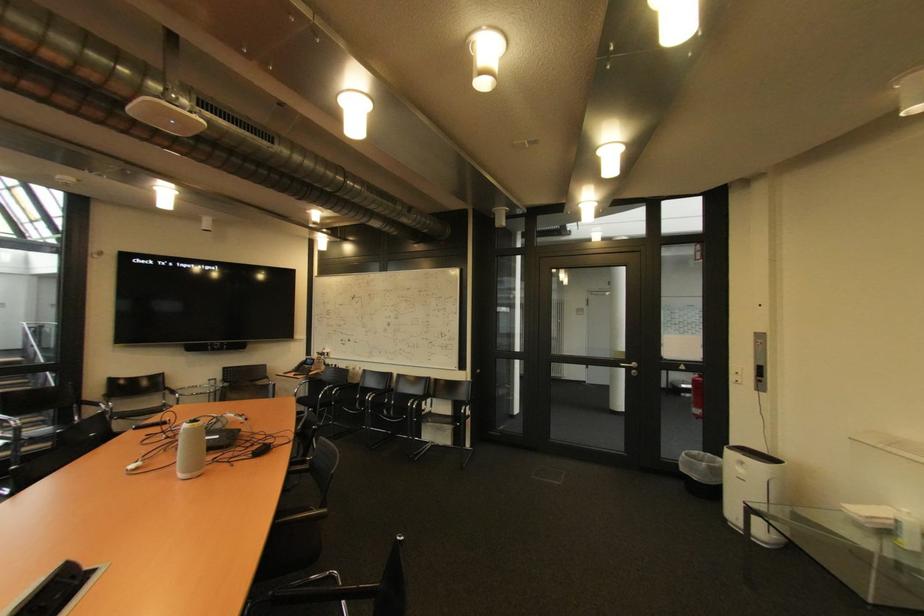
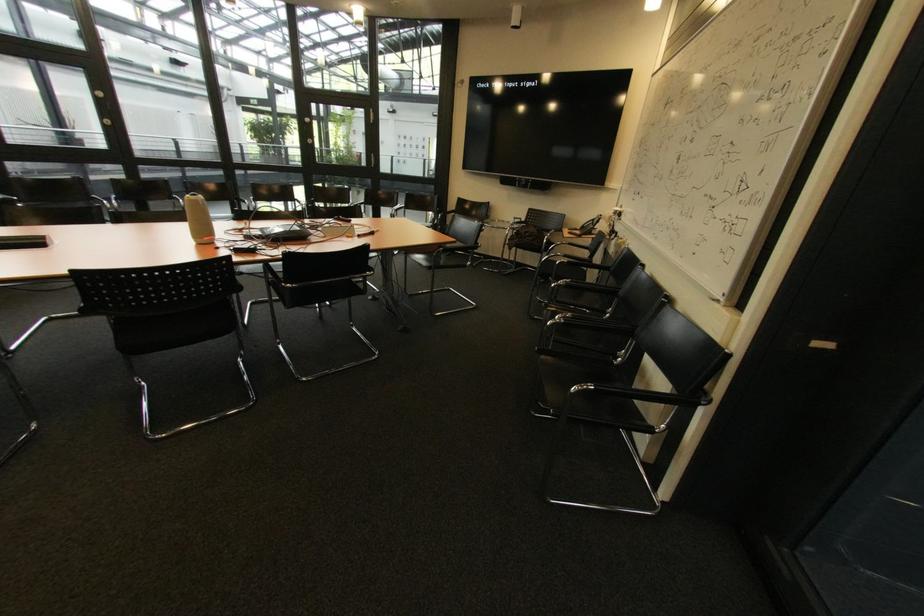
Where in the second image is the point corresponding to (417,406) from the first image?

(565, 318)